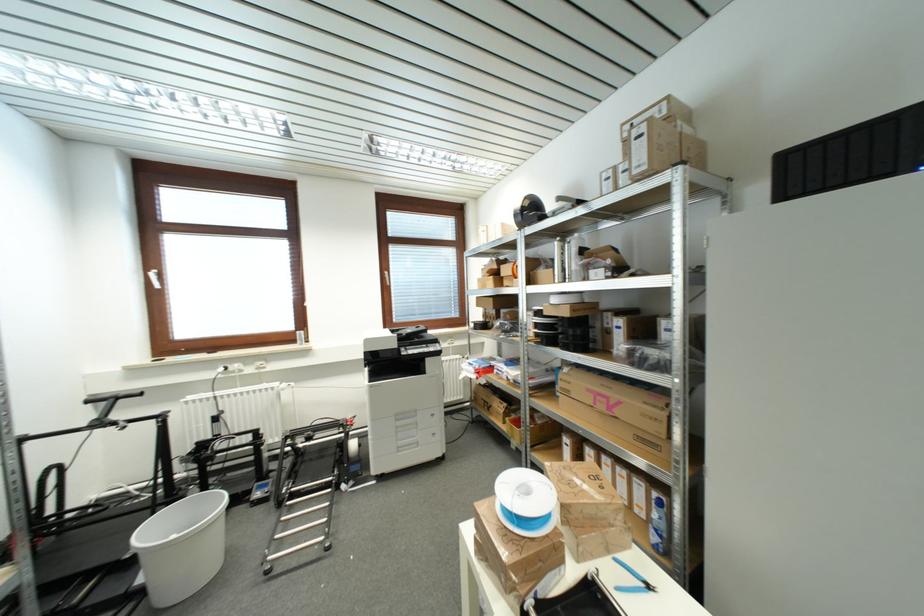
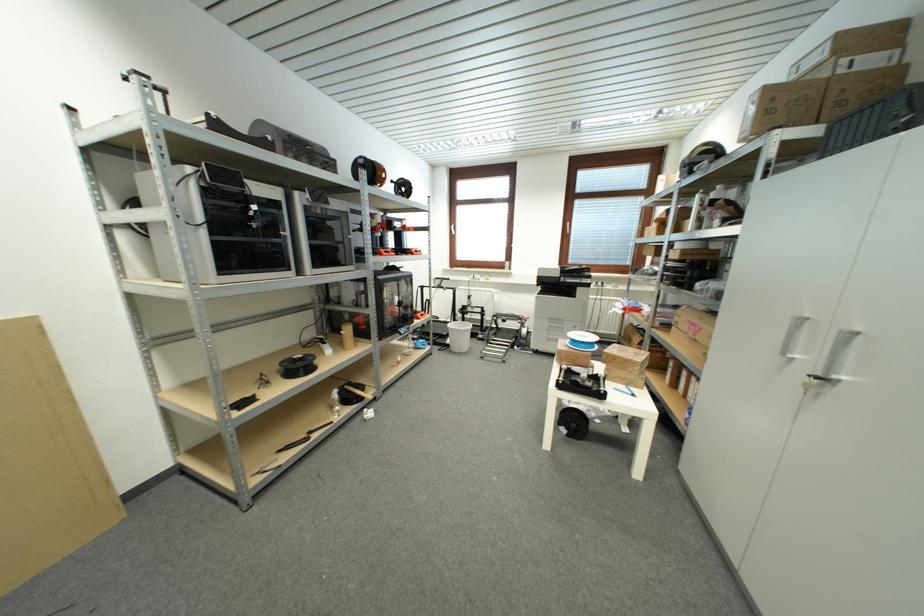
Where in the second image is the point corresponding to the point at 390,294 from the first image?

(569, 241)